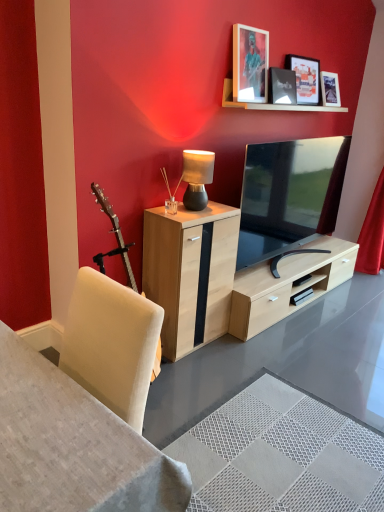
Question: Which direction should I rotate to look at matte black picture frame at upper center, the 2th picture frame when ordered from left to right?

Choices:
 (A) right
 (B) left

Answer: (A)

Question: Is the position of matte wooden picture frame at upper center, placed as the 1th picture frame when sorted from left to right, more distant than that of matte black tv at center?

Choices:
 (A) yes
 (B) no

Answer: (A)

Question: From the image's perspective, does matte wooden picture frame at upper center, placed as the 1th picture frame when sorted from left to right, appear higher than matte black tv at center?

Choices:
 (A) yes
 (B) no

Answer: (A)

Question: Is matte wooden picture frame at upper center, the 3th picture frame positioned from the right, shorter than matte black tv at center?

Choices:
 (A) yes
 (B) no

Answer: (A)

Question: Is matte wooden picture frame at upper center, the 3th picture frame positioned from the right, positioned with its back to matte black tv at center?

Choices:
 (A) yes
 (B) no

Answer: (B)

Question: Does matte wooden picture frame at upper center, the 3th picture frame positioned from the right, have a larger size compared to matte black tv at center?

Choices:
 (A) no
 (B) yes

Answer: (A)

Question: Is matte wooden picture frame at upper center, placed as the 1th picture frame when sorted from left to right, to the left of matte black tv at center from the viewer's perspective?

Choices:
 (A) no
 (B) yes

Answer: (B)

Question: Considering the relative positions of matte wooden picture frame at upper center, the 3th picture frame positioned from the right, and white fabric desk at lower left in the image provided, is matte wooden picture frame at upper center, the 3th picture frame positioned from the right, to the right of white fabric desk at lower left from the viewer's perspective?

Choices:
 (A) yes
 (B) no

Answer: (A)

Question: Considering the relative positions of matte wooden picture frame at upper center, the 3th picture frame positioned from the right, and white fabric desk at lower left in the image provided, is matte wooden picture frame at upper center, the 3th picture frame positioned from the right, in front of white fabric desk at lower left?

Choices:
 (A) no
 (B) yes

Answer: (A)

Question: Is matte wooden picture frame at upper center, placed as the 1th picture frame when sorted from left to right, positioned beyond the bounds of white fabric desk at lower left?

Choices:
 (A) no
 (B) yes

Answer: (B)

Question: Does matte wooden picture frame at upper center, the 3th picture frame positioned from the right, have a greater width compared to white fabric desk at lower left?

Choices:
 (A) no
 (B) yes

Answer: (A)

Question: Does matte wooden picture frame at upper center, placed as the 1th picture frame when sorted from left to right, lie behind white fabric desk at lower left?

Choices:
 (A) yes
 (B) no

Answer: (A)

Question: Does matte wooden picture frame at upper center, the 3th picture frame positioned from the right, have a smaller size compared to white fabric desk at lower left?

Choices:
 (A) yes
 (B) no

Answer: (A)

Question: Can you confirm if matte black table lamp at center is smaller than matte black tv at center?

Choices:
 (A) yes
 (B) no

Answer: (A)